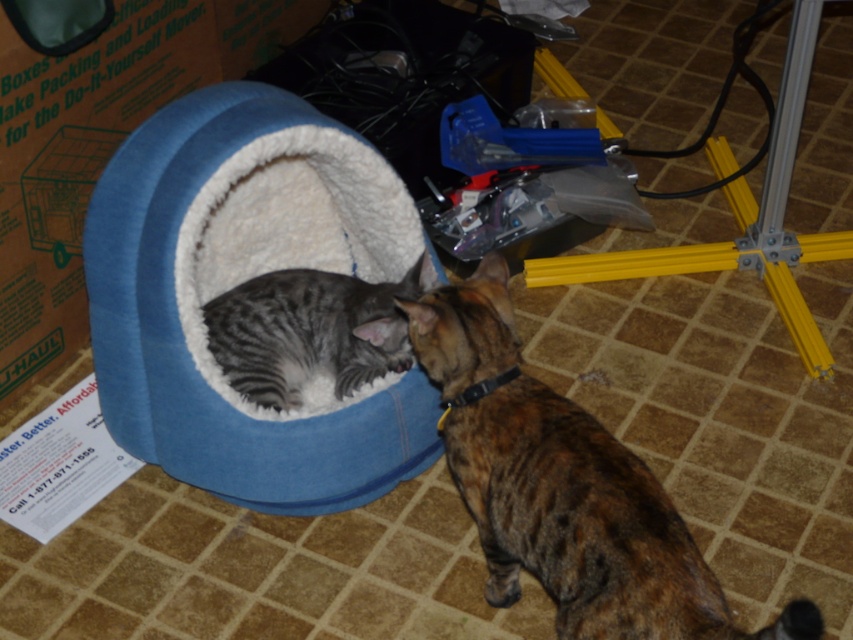
Can you confirm if brown textured fur cat at center is thinner than gray striped cat at center?

No, brown textured fur cat at center is not thinner than gray striped cat at center.

Which is in front, point (612, 604) or point (277, 385)?

Point (612, 604) is in front.

The height and width of the screenshot is (640, 853). I want to click on brown textured fur cat at center, so click(x=563, y=486).

At what (x,y) coordinates should I click in order to perform the action: click on brown textured fur cat at center. Please return your answer as a coordinate pair (x, y). This screenshot has width=853, height=640. Looking at the image, I should click on (563, 486).

Does blue plush cat bed at center appear on the left side of gray striped cat at center?

Correct, you'll find blue plush cat bed at center to the left of gray striped cat at center.

Between blue plush cat bed at center and gray striped cat at center, which one has less height?

gray striped cat at center is shorter.

Which is in front, point (335, 410) or point (274, 397)?

Point (335, 410) is more forward.

Identify the location of blue plush cat bed at center. (236, 284).

Between blue plush cat bed at center and brown textured fur cat at center, which one appears on the left side from the viewer's perspective?

Positioned to the left is blue plush cat bed at center.

Based on the photo, does blue plush cat bed at center have a larger size compared to brown textured fur cat at center?

Correct, blue plush cat bed at center is larger in size than brown textured fur cat at center.

This screenshot has height=640, width=853. I want to click on blue plush cat bed at center, so click(x=236, y=284).

Locate an element on the screen. blue plush cat bed at center is located at coordinates (236, 284).